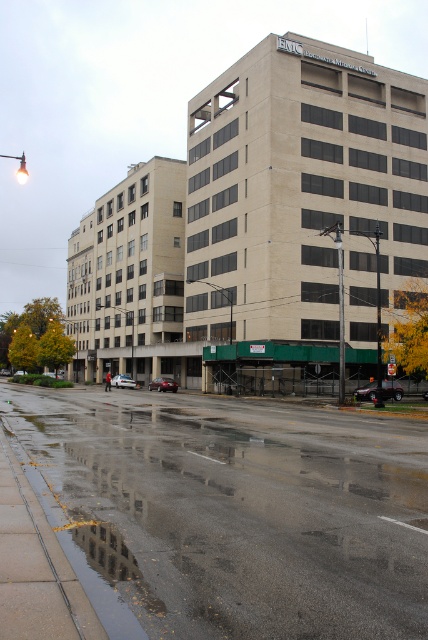
You are standing in front of the EMC Edgewater Medical Center and want to take a photo of both point (225, 493) and point (388, 392) in the same frame. Which point will appear larger in your photo?

Point (225, 493) will appear larger in the photo because it is closer to the camera than point (388, 392).

You are standing in front of the EMC Edgewater Medical Center and want to take a photo. You notice two points marked on the building. One is at point (398, 390) and the other at point (172, 390). Which point will appear larger in your photo?

Point (398, 390) will appear larger in the photo because it is closer to the camera than point (172, 390).

You are standing at the point labeled point (x=232, y=512) in the image. What type of surface are you standing on?

The point (x=232, y=512) indicates glossy asphalt road at lower center, so you are standing on a glossy asphalt road.